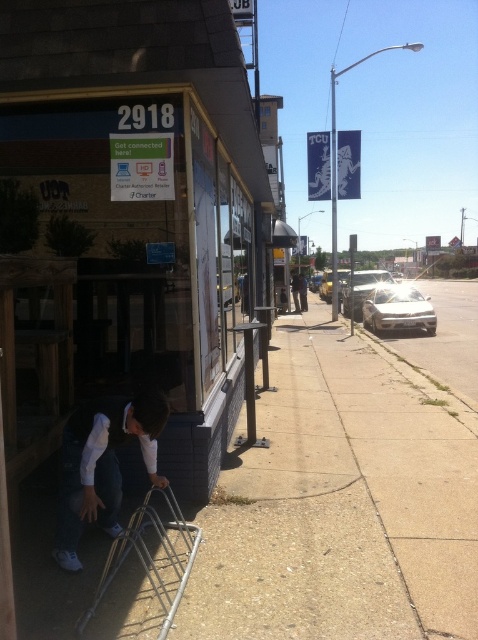
You are a delivery person standing on the sidewalk. You need to place a large package on the white matte squat at lower left and the white matte car at right. Which object can you place the package on without needing to climb a ladder?

The white matte squat at lower left has a lesser height compared to white matte car at right, so you can place the package on the white matte squat at lower left without needing to climb a ladder.

You are standing at point [111,525] and want to walk to point [397,301]. Which direction should you move relative to the building with the sign 2918?

You should move towards the building with the sign 2918 because point [111,525] is in front of point [397,301], meaning the latter is behind the former relative to the building.